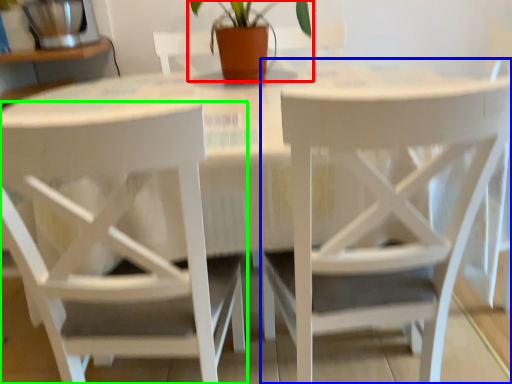
Question: Considering the real-world distances, which object is closest to houseplant (highlighted by a red box)? chair (highlighted by a blue box) or chair (highlighted by a green box).

Choices:
 (A) chair
 (B) chair

Answer: (A)